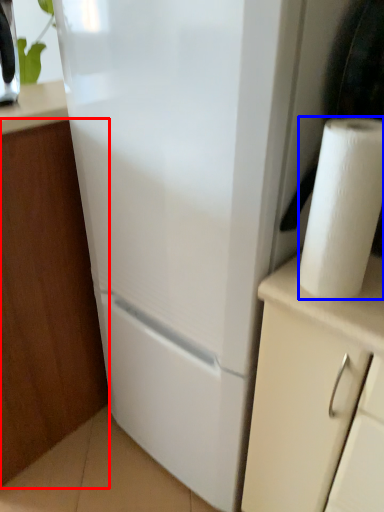
Question: Which of the following is the closest to the observer, cabinetry (highlighted by a red box) or paper towel (highlighted by a blue box)?

Choices:
 (A) cabinetry
 (B) paper towel

Answer: (B)